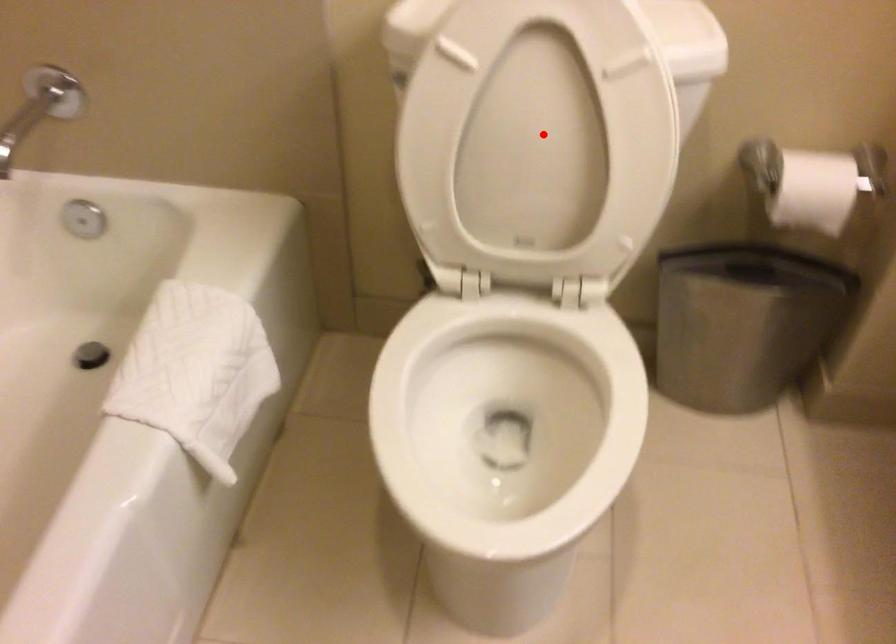
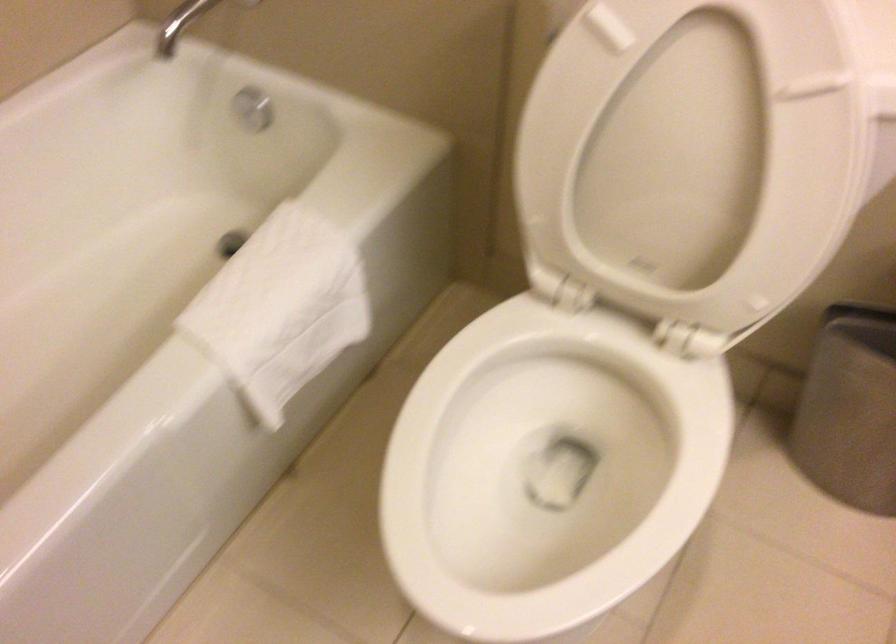
Question: I am providing you with two images of the same scene from different viewpoints. Given a red point in image1, look at the same physical point in image2. Is it:

Choices:
 (A) Closer to the viewpoint
 (B) Farther from the viewpoint

Answer: (A)